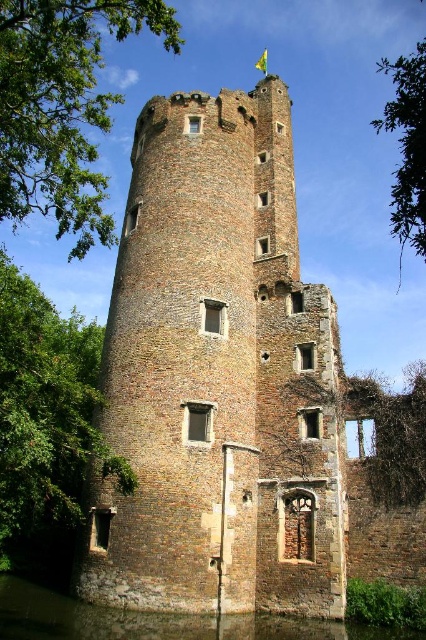
What do you see at coordinates (155, 621) in the screenshot?
I see `clear water at lower left` at bounding box center [155, 621].

Who is shorter, clear water at lower left or green leafy tree at upper right?

With less height is clear water at lower left.

Does point (141, 621) come behind point (411, 83)?

That is True.

At what (x,y) coordinates should I click in order to perform the action: click on clear water at lower left. Please return your answer as a coordinate pair (x, y). The width and height of the screenshot is (426, 640). Looking at the image, I should click on (155, 621).

Can you confirm if green leafy tree at lower left is wider than green leafy tree at lower right?

Incorrect, green leafy tree at lower left's width does not surpass green leafy tree at lower right's.

Between point (0, 403) and point (402, 403), which one is positioned in front?

Positioned in front is point (0, 403).

The height and width of the screenshot is (640, 426). In order to click on green leafy tree at lower left in this screenshot , I will do `click(46, 419)`.

Is green leafy tree at lower left thinner than green leafy tree at upper right?

Yes, green leafy tree at lower left is thinner than green leafy tree at upper right.

Which is behind, point (57, 420) or point (396, 97)?

The point (396, 97) is more distant.

The width and height of the screenshot is (426, 640). Identify the location of green leafy tree at lower left. (46, 419).